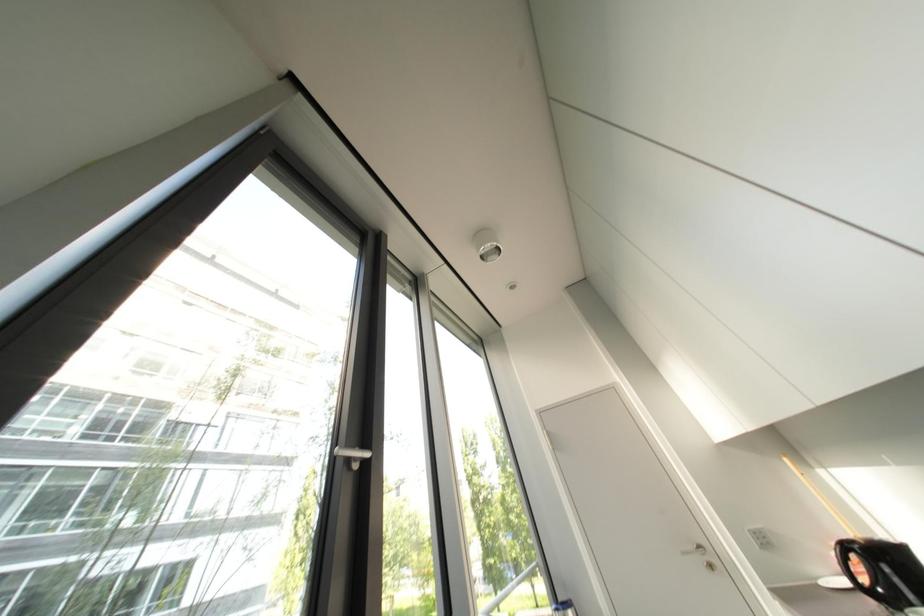
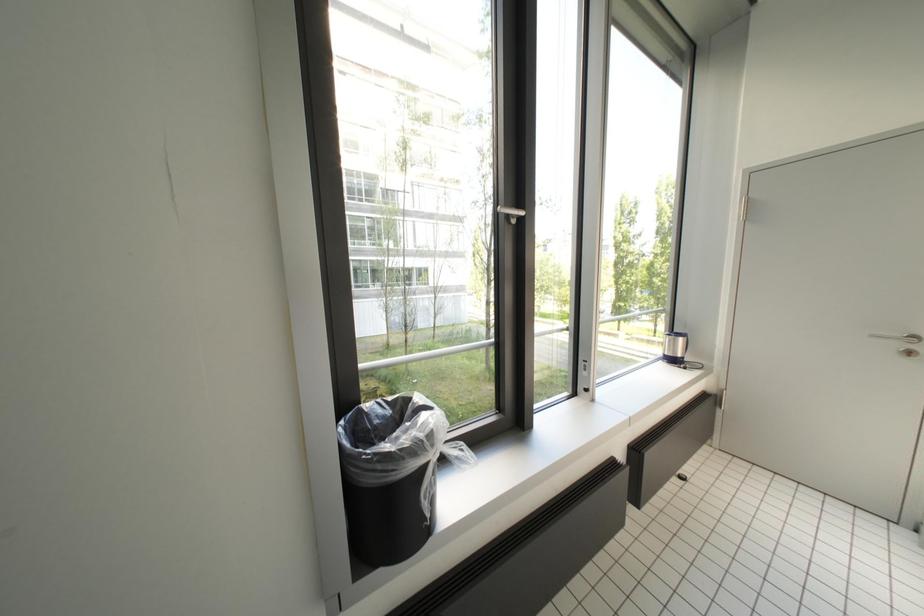
The first image is from the beginning of the video and the second image is from the end. How did the camera likely rotate when shooting the video?

The camera's rotation is toward left-down.